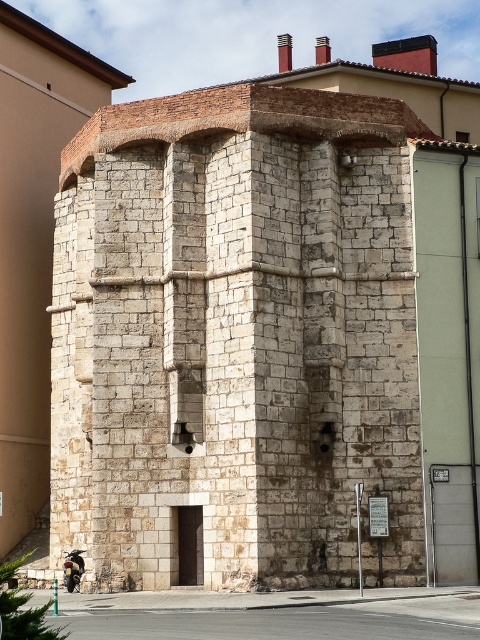
Question: Which point is farther to the camera?

Choices:
 (A) (67, 573)
 (B) (64, 397)

Answer: (B)

Question: Is white stone tower at center wider than shiny chrome motorcycle at lower left?

Choices:
 (A) no
 (B) yes

Answer: (B)

Question: Can you confirm if white stone tower at center is thinner than shiny chrome motorcycle at lower left?

Choices:
 (A) no
 (B) yes

Answer: (A)

Question: Which object is farther from the camera taking this photo?

Choices:
 (A) white stone tower at center
 (B) shiny chrome motorcycle at lower left

Answer: (B)

Question: Is white stone tower at center positioned behind shiny chrome motorcycle at lower left?

Choices:
 (A) yes
 (B) no

Answer: (B)